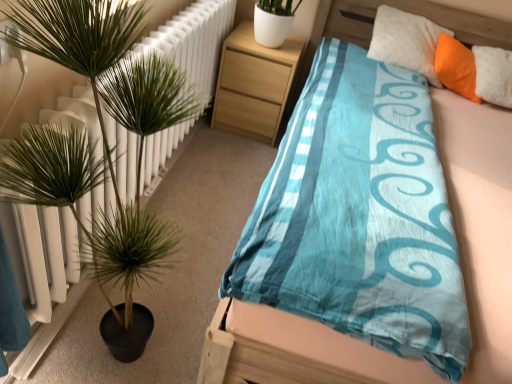
Question: Does point (209, 359) appear closer or farther from the camera than point (238, 99)?

Choices:
 (A) closer
 (B) farther

Answer: (A)

Question: Relative to light wood/texture nightstand at upper center, is blue satin bed at center in front or behind?

Choices:
 (A) front
 (B) behind

Answer: (A)

Question: Which of these objects is positioned closest to the blue satin bed at center?

Choices:
 (A) green leafy plant at left
 (B) light wood/texture nightstand at upper center

Answer: (A)

Question: Based on their relative distances, which object is nearer to the blue satin bed at center?

Choices:
 (A) light wood/texture nightstand at upper center
 (B) green leafy plant at left

Answer: (B)